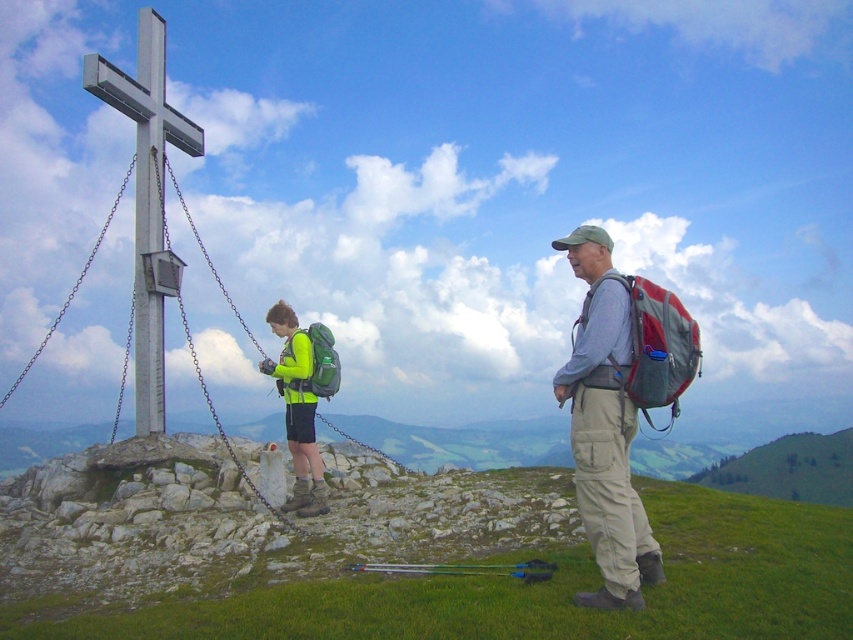
You are planning to place a new sign at the summit. The sign needs to be visible from both the matte gray backpack at right and the green matte backpack at center. Based on their positions, where should the sign be placed?

The sign should be placed in a position where both the matte gray backpack at right and the green matte backpack at center can see it. Since the matte gray backpack at right is positioned over the green matte backpack at center, placing the sign above or to the side of both backpacks would ensure visibility from both locations.

You are planning to take a photo of the metallic silver cross at upper left and the matte gray backpack at right. Which object should you focus on first if you want to capture both in the frame without moving the camera?

You should focus on the metallic silver cross at upper left first because it is wider than the matte gray backpack at right, so it will occupy more space in the frame.